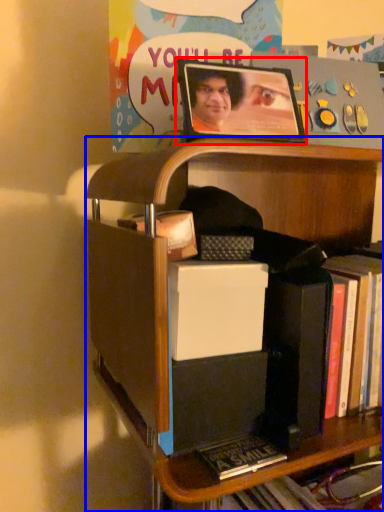
Question: Which of the following is the farthest to the observer, picture frame (highlighted by a red box) or shelf (highlighted by a blue box)?

Choices:
 (A) picture frame
 (B) shelf

Answer: (A)